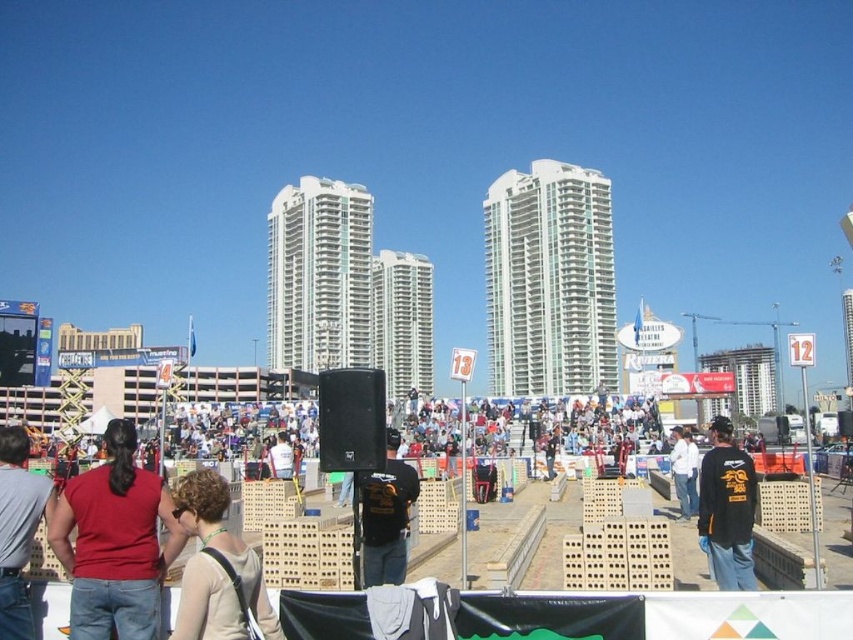
You are at an outdoor event and see two people wearing a matte red shirt at lower left and a matte black shirt at center. Which person is standing closer to you?

The matte red shirt at lower left is closer to the viewer than the matte black shirt at center.

You are standing at the center of the stage where the large black speaker is placed. You want to take a photo of both the point at coordinates (1, 497) and the point at (268, 451). Which point should you focus on first to ensure both are in clear view?

You should focus on point (1, 497) first because it is closer to the camera than point (268, 451). This way, both points will be in focus as the closer point determines the focal plane.

You are standing at the center of the event area and see two points marked in the image. The first point is at coordinate point (711,448) and the second is at coordinate point (364,538). Which point is closer to you?

Point (711,448) is further to the viewer than point (364,538), so the second point at coordinate point (364,538) is closer to you.